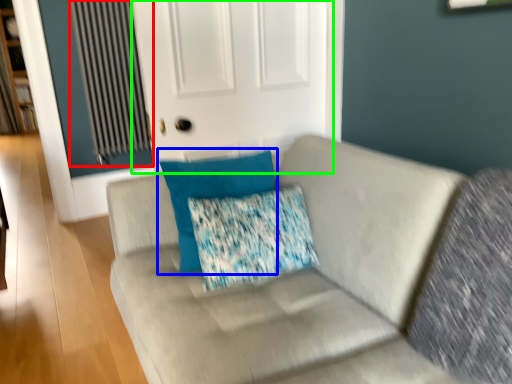
Question: Which object is positioned farthest from radiator (highlighted by a red box)? Select from pillow (highlighted by a blue box) and screen door (highlighted by a green box).

Choices:
 (A) pillow
 (B) screen door

Answer: (A)